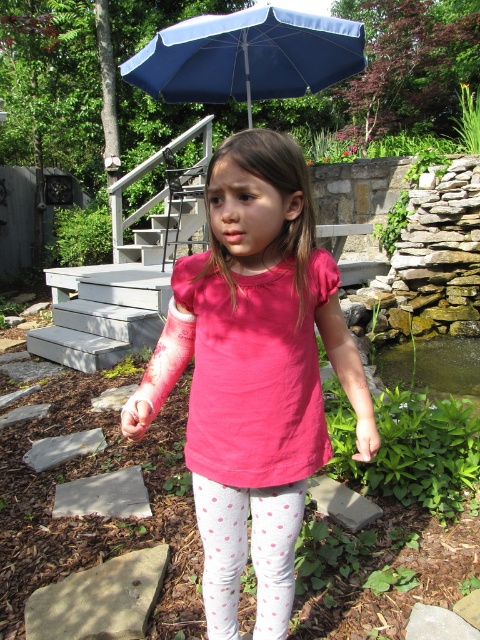
You are a fashion designer observing the young girl in the garden. You need to determine the placement of a new accessory between the pink fabric shirt at center and the white polka dot leggings at lower center. Based on their positions, which clothing item is higher up on her body?

The pink fabric shirt at center is much taller than the white polka dot leggings at lower center, so the pink fabric shirt at center is higher up on her body.

You are a painter standing at the base of the wooden steps in the garden. You want to paint the blue fabric umbrella at upper center and the white polka dot leggings at lower center. Which object will require you to look upwards more?

The blue fabric umbrella at upper center is much taller than the white polka dot leggings at lower center, so you will need to look upwards more to paint the blue fabric umbrella at upper center.

You are planning to set up a small tent under the blue fabric umbrella at upper center and the white polka dot leggings at lower center. Which object would provide more shade for the tent?

The blue fabric umbrella at upper center is larger in size than the white polka dot leggings at lower center, so it would provide more shade for the tent.